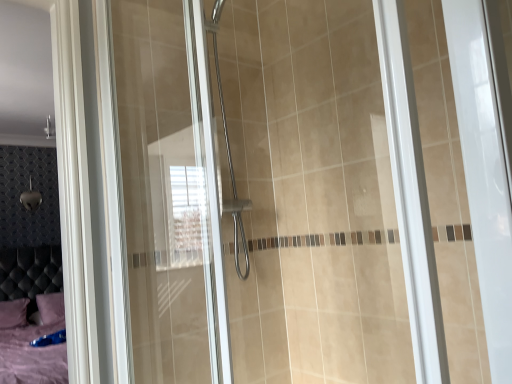
Based on the photo, in order to face purple fabric pillow at lower left, acting as the 2th pillow starting from the right, should I rotate leftwards or rightwards?

Turn left approximately 29.963 degrees to face it.

How much space does purple fabric pillow at lower left, acting as the 2th pillow starting from the right, occupy vertically?

The height of purple fabric pillow at lower left, acting as the 2th pillow starting from the right, is 11.32 inches.

What do you see at coordinates (257, 194) in the screenshot? The height and width of the screenshot is (384, 512). I see `transparent glass shower door at center` at bounding box center [257, 194].

Identify the location of transparent glass shower door at center. (257, 194).

Describe the element at coordinates (50, 308) in the screenshot. I see `purple fabric pillow at lower left, the second pillow from the left` at that location.

You are a GUI agent. You are given a task and a screenshot of the screen. Output one action in this format:
    pyautogui.click(x=<x>, y=<y>)
    Task: Click on the purple fabric pillow at lower left, the first pillow viewed from the right
    
    Given the screenshot: What is the action you would take?
    pyautogui.click(x=50, y=308)

The width and height of the screenshot is (512, 384). Identify the location of purple fabric pillow at lower left, which appears as the 1th pillow when viewed from the left. pos(13,313).

Can you confirm if transparent glass shower door at center is bigger than purple fabric pillow at lower left, which appears as the 1th pillow when viewed from the left?

Indeed, transparent glass shower door at center has a larger size compared to purple fabric pillow at lower left, which appears as the 1th pillow when viewed from the left.

From the image's perspective, would you say transparent glass shower door at center is shown under purple fabric pillow at lower left, which appears as the 1th pillow when viewed from the left?

No, from the image's perspective, transparent glass shower door at center is not beneath purple fabric pillow at lower left, which appears as the 1th pillow when viewed from the left.

Which object is further away from the camera taking this photo, transparent glass shower door at center or purple fabric pillow at lower left, which appears as the 1th pillow when viewed from the left?

purple fabric pillow at lower left, which appears as the 1th pillow when viewed from the left, is more distant.

Based on the photo, considering the relative positions of transparent glass shower door at center and purple fabric pillow at lower left, acting as the 2th pillow starting from the right, in the image provided, is transparent glass shower door at center to the left or to the right of purple fabric pillow at lower left, acting as the 2th pillow starting from the right,?

Clearly, transparent glass shower door at center is on the right of purple fabric pillow at lower left, acting as the 2th pillow starting from the right, in the image.

From a real-world perspective, is purple fabric pillow at lower left, acting as the 2th pillow starting from the right, on transparent glass shower door at center?

No, from a real-world perspective, purple fabric pillow at lower left, acting as the 2th pillow starting from the right, is not on top of transparent glass shower door at center.

The width and height of the screenshot is (512, 384). Identify the location of glass door located in front of the purple fabric pillow at lower left, acting as the 2th pillow starting from the right. pyautogui.click(x=257, y=194).

From the picture: Considering the relative positions of purple fabric pillow at lower left, which appears as the 1th pillow when viewed from the left, and transparent glass shower door at center in the image provided, is purple fabric pillow at lower left, which appears as the 1th pillow when viewed from the left, to the left or to the right of transparent glass shower door at center?

purple fabric pillow at lower left, which appears as the 1th pillow when viewed from the left, is to the left of transparent glass shower door at center.

Which is correct: purple fabric pillow at lower left, acting as the 2th pillow starting from the right, is inside transparent glass shower door at center, or outside of it?

The correct answer is: outside.

From the image's perspective, does purple fabric pillow at lower left, acting as the 2th pillow starting from the right, appear lower than purple fabric pillow at lower left, the second pillow from the left?

Indeed, from the image's perspective, purple fabric pillow at lower left, acting as the 2th pillow starting from the right, is shown beneath purple fabric pillow at lower left, the second pillow from the left.

Does purple fabric pillow at lower left, acting as the 2th pillow starting from the right, have a greater width compared to purple fabric pillow at lower left, the first pillow viewed from the right?

Indeed, purple fabric pillow at lower left, acting as the 2th pillow starting from the right, has a greater width compared to purple fabric pillow at lower left, the first pillow viewed from the right.

Is the surface of purple fabric pillow at lower left, which appears as the 1th pillow when viewed from the left, in direct contact with purple fabric pillow at lower left, the second pillow from the left?

No, purple fabric pillow at lower left, which appears as the 1th pillow when viewed from the left, is not touching purple fabric pillow at lower left, the second pillow from the left.

Who is shorter, purple fabric pillow at lower left, acting as the 2th pillow starting from the right, or purple fabric pillow at lower left, the second pillow from the left?

With less height is purple fabric pillow at lower left, the second pillow from the left.

Considering the relative sizes of purple fabric pillow at lower left, the first pillow viewed from the right, and purple fabric pillow at lower left, which appears as the 1th pillow when viewed from the left, in the image provided, is purple fabric pillow at lower left, the first pillow viewed from the right, shorter than purple fabric pillow at lower left, which appears as the 1th pillow when viewed from the left,?

Indeed, purple fabric pillow at lower left, the first pillow viewed from the right, has a lesser height compared to purple fabric pillow at lower left, which appears as the 1th pillow when viewed from the left.

Is purple fabric pillow at lower left, the second pillow from the left, bigger or smaller than purple fabric pillow at lower left, acting as the 2th pillow starting from the right?

purple fabric pillow at lower left, the second pillow from the left, is smaller than purple fabric pillow at lower left, acting as the 2th pillow starting from the right.

Relative to purple fabric pillow at lower left, which appears as the 1th pillow when viewed from the left, is purple fabric pillow at lower left, the second pillow from the left, in front or behind?

purple fabric pillow at lower left, the second pillow from the left, is positioned closer to the viewer than purple fabric pillow at lower left, which appears as the 1th pillow when viewed from the left.

From a real-world perspective, is purple fabric pillow at lower left, the first pillow viewed from the right, below purple fabric pillow at lower left, which appears as the 1th pillow when viewed from the left?

No, from a real-world perspective, purple fabric pillow at lower left, the first pillow viewed from the right, is not beneath purple fabric pillow at lower left, which appears as the 1th pillow when viewed from the left.

Is transparent glass shower door at center aimed at purple fabric pillow at lower left, the second pillow from the left?

No, transparent glass shower door at center is not aimed at purple fabric pillow at lower left, the second pillow from the left.

What are the coordinates of `glass door in front of the purple fabric pillow at lower left, the second pillow from the left` in the screenshot? It's located at (257, 194).

Which object is closer to the camera taking this photo, transparent glass shower door at center or purple fabric pillow at lower left, the second pillow from the left?

transparent glass shower door at center is in front.

From a real-world perspective, does transparent glass shower door at center stand above purple fabric pillow at lower left, the first pillow viewed from the right?

Yes, from a real-world perspective, transparent glass shower door at center is on top of purple fabric pillow at lower left, the first pillow viewed from the right.

Considering the relative positions of purple fabric pillow at lower left, the second pillow from the left, and transparent glass shower door at center in the image provided, is purple fabric pillow at lower left, the second pillow from the left, behind transparent glass shower door at center?

Yes, it is behind transparent glass shower door at center.

In terms of height, does purple fabric pillow at lower left, the first pillow viewed from the right, look taller or shorter compared to transparent glass shower door at center?

purple fabric pillow at lower left, the first pillow viewed from the right, is shorter than transparent glass shower door at center.

From the image's perspective, is purple fabric pillow at lower left, the first pillow viewed from the right, on transparent glass shower door at center?

No, from the image's perspective, purple fabric pillow at lower left, the first pillow viewed from the right, is not on top of transparent glass shower door at center.

The width and height of the screenshot is (512, 384). In order to click on pillow that is the 2nd one below the transparent glass shower door at center (from a real-world perspective) in this screenshot , I will do `click(13, 313)`.

Locate an element on the screen. Image resolution: width=512 pixels, height=384 pixels. glass door above the purple fabric pillow at lower left, acting as the 2th pillow starting from the right (from a real-world perspective) is located at coordinates coord(257,194).

Estimate the real-world distances between objects in this image. Which object is further from purple fabric pillow at lower left, which appears as the 1th pillow when viewed from the left, purple fabric pillow at lower left, the second pillow from the left, or transparent glass shower door at center?

transparent glass shower door at center is further to purple fabric pillow at lower left, which appears as the 1th pillow when viewed from the left.

Looking at this image, looking at the image, which one is located closer to transparent glass shower door at center, purple fabric pillow at lower left, the second pillow from the left, or purple fabric pillow at lower left, acting as the 2th pillow starting from the right?

purple fabric pillow at lower left, the second pillow from the left, lies closer to transparent glass shower door at center than the other object.

Based on their spatial positions, is transparent glass shower door at center or purple fabric pillow at lower left, acting as the 2th pillow starting from the right, further from purple fabric pillow at lower left, the second pillow from the left?

transparent glass shower door at center lies further to purple fabric pillow at lower left, the second pillow from the left, than the other object.

Based on their spatial positions, is transparent glass shower door at center or purple fabric pillow at lower left, the first pillow viewed from the right, closer to purple fabric pillow at lower left, which appears as the 1th pillow when viewed from the left?

purple fabric pillow at lower left, the first pillow viewed from the right, lies closer to purple fabric pillow at lower left, which appears as the 1th pillow when viewed from the left, than the other object.

From the image, which object appears to be farther from transparent glass shower door at center, purple fabric pillow at lower left, acting as the 2th pillow starting from the right, or purple fabric pillow at lower left, the second pillow from the left?

purple fabric pillow at lower left, acting as the 2th pillow starting from the right, lies further to transparent glass shower door at center than the other object.

In the scene shown: Estimate the real-world distances between objects in this image. Which object is closer to purple fabric pillow at lower left, the second pillow from the left, purple fabric pillow at lower left, acting as the 2th pillow starting from the right, or transparent glass shower door at center?

The object closer to purple fabric pillow at lower left, the second pillow from the left, is purple fabric pillow at lower left, acting as the 2th pillow starting from the right.

This screenshot has height=384, width=512. I want to click on pillow between transparent glass shower door at center and purple fabric pillow at lower left, which appears as the 1th pillow when viewed from the left, along the z-axis, so click(50, 308).